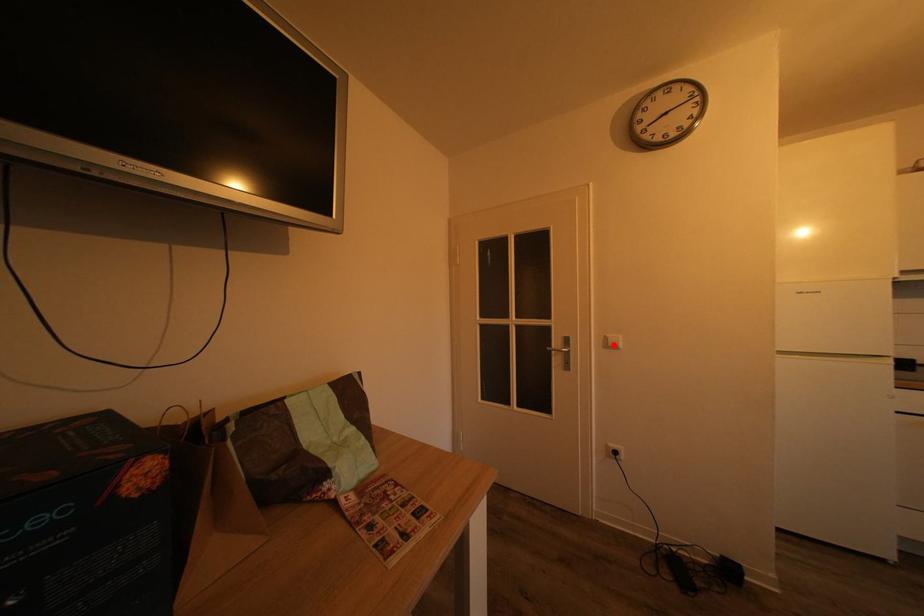
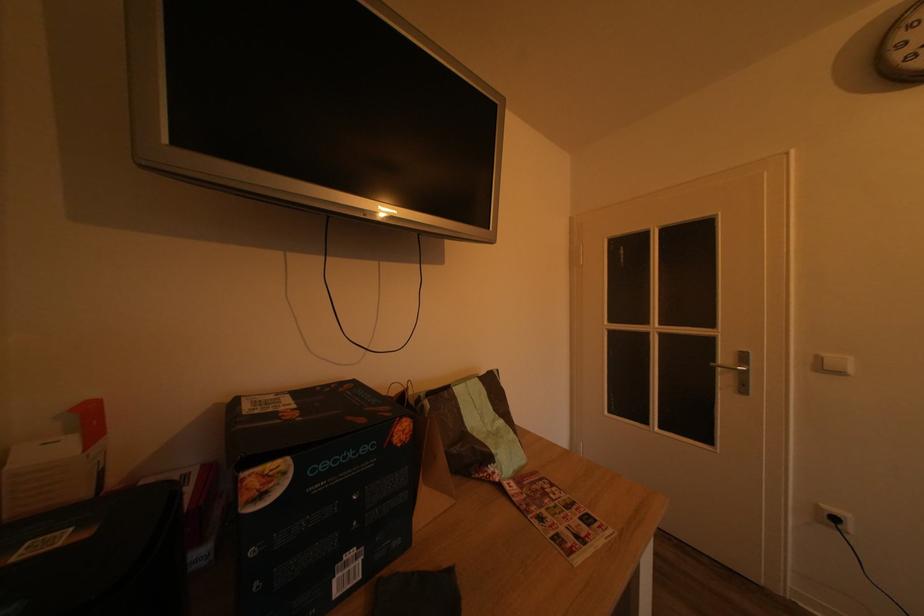
Find the pixel in the second image that matches the highlighted location in the first image.

(825, 365)